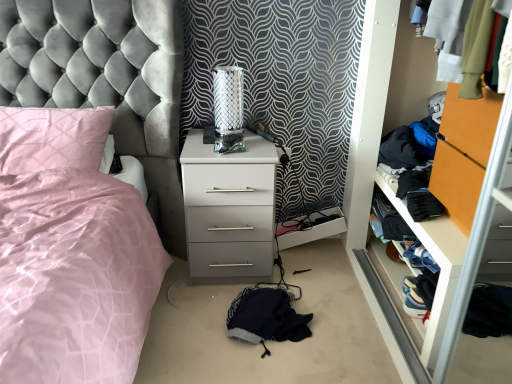
In order to click on free point in front of denim jeans at lower right, marked as the first clothing in a right-to-left arrangement in this screenshot , I will do `click(409, 329)`.